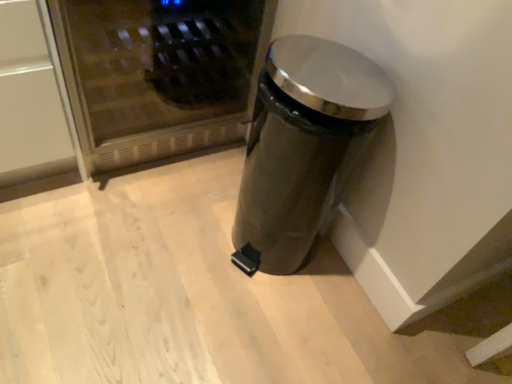
Question: Does satin silver trash can at lower right contain stainless steel microwave at upper left?

Choices:
 (A) yes
 (B) no

Answer: (B)

Question: From a real-world perspective, is satin silver trash can at lower right under stainless steel microwave at upper left?

Choices:
 (A) yes
 (B) no

Answer: (B)

Question: Is stainless steel microwave at upper left at the back of satin silver trash can at lower right?

Choices:
 (A) no
 (B) yes

Answer: (B)

Question: Is satin silver trash can at lower right far from stainless steel microwave at upper left?

Choices:
 (A) no
 (B) yes

Answer: (A)

Question: Can you confirm if satin silver trash can at lower right is taller than stainless steel microwave at upper left?

Choices:
 (A) no
 (B) yes

Answer: (B)

Question: Is satin silver trash can at lower right next to stainless steel microwave at upper left and touching it?

Choices:
 (A) no
 (B) yes

Answer: (A)

Question: Does stainless steel microwave at upper left have a lesser width compared to satin silver trash can at lower right?

Choices:
 (A) no
 (B) yes

Answer: (A)

Question: From the image's perspective, is stainless steel microwave at upper left located beneath satin silver trash can at lower right?

Choices:
 (A) no
 (B) yes

Answer: (A)

Question: Is stainless steel microwave at upper left next to satin silver trash can at lower right and touching it?

Choices:
 (A) yes
 (B) no

Answer: (B)

Question: Is stainless steel microwave at upper left completely or partially outside of satin silver trash can at lower right?

Choices:
 (A) no
 (B) yes

Answer: (B)

Question: Considering the relative positions of stainless steel microwave at upper left and satin silver trash can at lower right in the image provided, is stainless steel microwave at upper left in front of satin silver trash can at lower right?

Choices:
 (A) yes
 (B) no

Answer: (B)

Question: Does stainless steel microwave at upper left have a lesser height compared to satin silver trash can at lower right?

Choices:
 (A) no
 (B) yes

Answer: (B)

Question: From their relative heights in the image, would you say satin silver trash can at lower right is taller or shorter than stainless steel microwave at upper left?

Choices:
 (A) short
 (B) tall

Answer: (B)